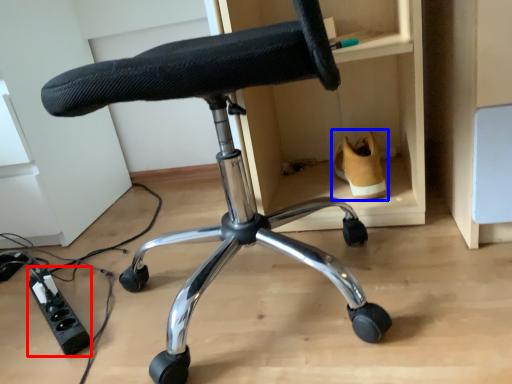
Question: Which point is further to the camera, plug (highlighted by a red box) or footwear (highlighted by a blue box)?

Choices:
 (A) plug
 (B) footwear

Answer: (B)